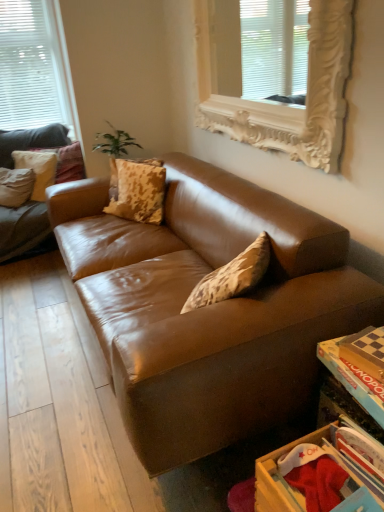
Question: Considering their positions, is brown leather couch at left located in front of or behind white matte window at upper left, which appears as the 2th window when viewed from the front?

Choices:
 (A) behind
 (B) front

Answer: (B)

Question: Considering the positions of brown leather couch at left and white matte window at upper left, which appears as the first window when viewed from the left, in the image, is brown leather couch at left taller or shorter than white matte window at upper left, which appears as the first window when viewed from the left,?

Choices:
 (A) short
 (B) tall

Answer: (A)

Question: Estimate the real-world distances between objects in this image. Which object is closer to the matte brown pillow at upper left, acting as the second pillow starting from the front?

Choices:
 (A) wooden drawer at lower right
 (B) camouflage-patterned pillow at center, the 1th pillow positioned from the front
 (C) white matte window at upper left, marked as the 2th window in a right-to-left arrangement
 (D) wooden monopoly board at lower right
 (E) brown leather couch at left

Answer: (C)

Question: Which of these objects is positioned farthest from the green leafy plant at upper left?

Choices:
 (A) matte brown pillow at upper left, acting as the second pillow starting from the front
 (B) wooden monopoly board at lower right
 (C) matte beige pillow at upper left, which is counted as the third pillow, starting from the front
 (D) wooden drawer at lower right
 (E) white ornate frame at upper center, arranged as the 2th window when viewed from the left

Answer: (D)